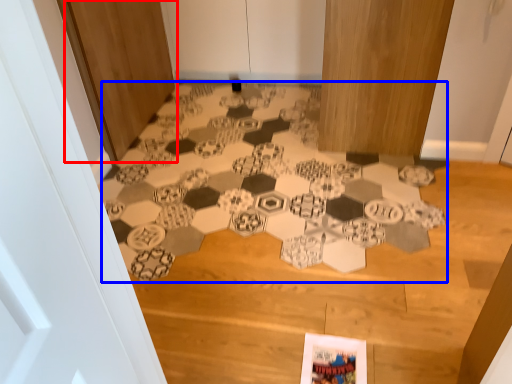
Question: Among these objects, which one is farthest to the camera, door (highlighted by a red box) or print (highlighted by a blue box)?

Choices:
 (A) door
 (B) print

Answer: (A)